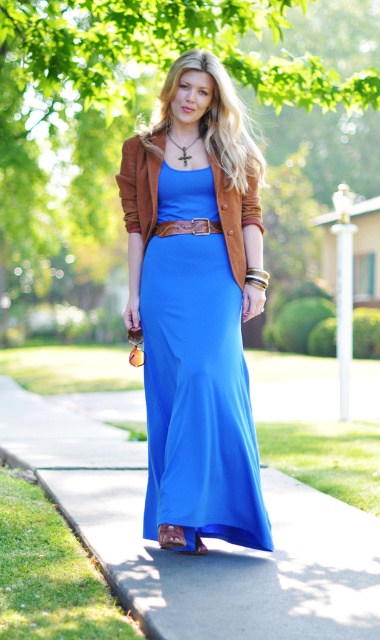
Question: From the image, what is the correct spatial relationship of smooth concrete pavement at lower center in relation to satin blue dress at center?

Choices:
 (A) below
 (B) above

Answer: (A)

Question: Which object appears farthest from the camera in this image?

Choices:
 (A) matte brown sandal at lower center
 (B) satin blue dress at center
 (C) matte blue fabric sandal at center

Answer: (C)

Question: Does matte brown sandal at lower center appear under matte blue fabric sandal at center?

Choices:
 (A) yes
 (B) no

Answer: (A)

Question: Which of the following is the farthest from the observer?

Choices:
 (A) matte brown sandal at lower center
 (B) smooth concrete pavement at lower center
 (C) satin blue dress at center
 (D) matte blue fabric sandal at center

Answer: (D)

Question: Which object appears closest to the camera in this image?

Choices:
 (A) satin blue dress at center
 (B) matte brown leather belt at center

Answer: (A)

Question: Does satin blue dress at center appear under suede jacket at center?

Choices:
 (A) yes
 (B) no

Answer: (A)